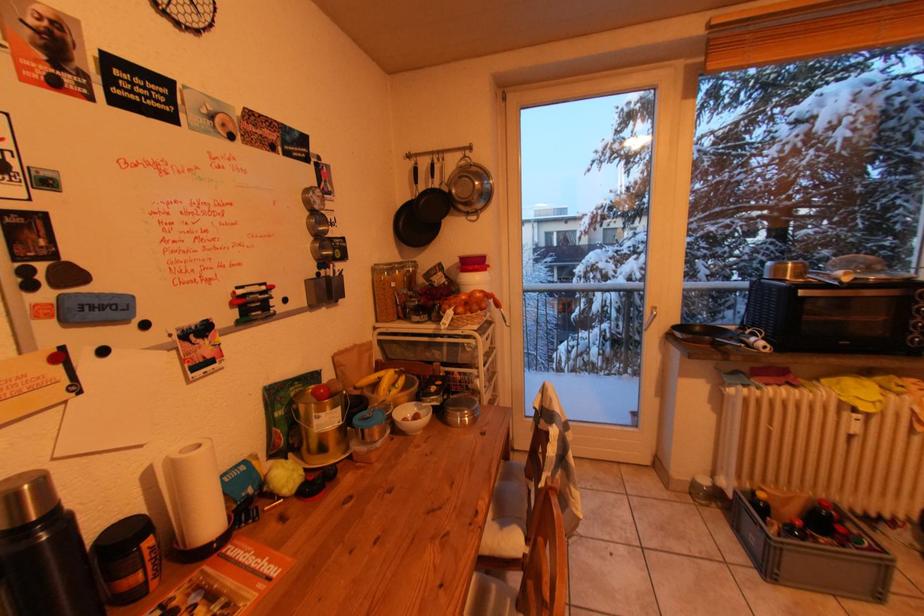
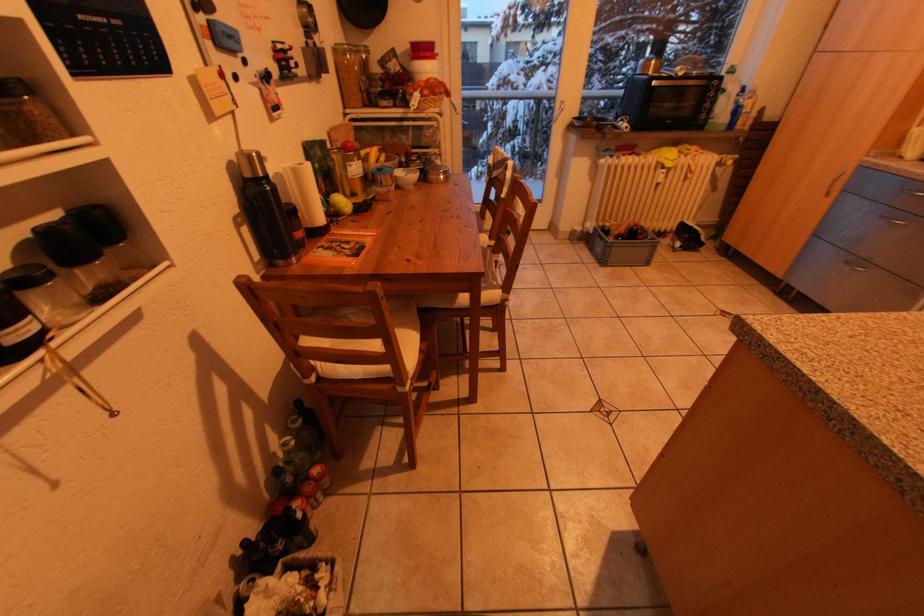
Based on the continuous images, in which direction is the camera rotating?

The rotation direction of the camera is right-down.